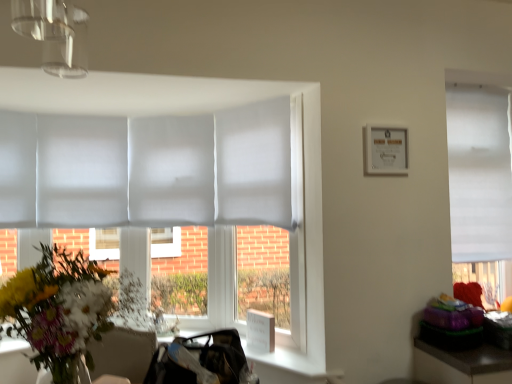
Question: In terms of height, does white paper picture frame at upper right look taller or shorter compared to white matte window at right?

Choices:
 (A) tall
 (B) short

Answer: (B)

Question: From the image's perspective, is white paper picture frame at upper right above or below white matte window at right?

Choices:
 (A) below
 (B) above

Answer: (B)

Question: Based on their relative distances, which object is farther from the vibrant floral bouquet at left?

Choices:
 (A) white matte window at right
 (B) white paper picture frame at upper right

Answer: (A)

Question: Which object is the closest to the white matte window at right?

Choices:
 (A) white paper picture frame at upper right
 (B) vibrant floral bouquet at left

Answer: (A)